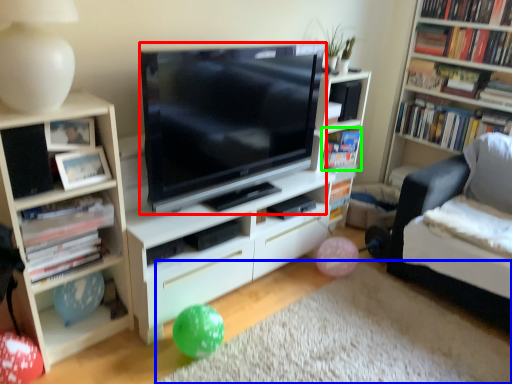
Question: Which object is the closest to the television (highlighted by a red box)? Choose among these: plain (highlighted by a blue box) or book (highlighted by a green box).

Choices:
 (A) plain
 (B) book

Answer: (B)